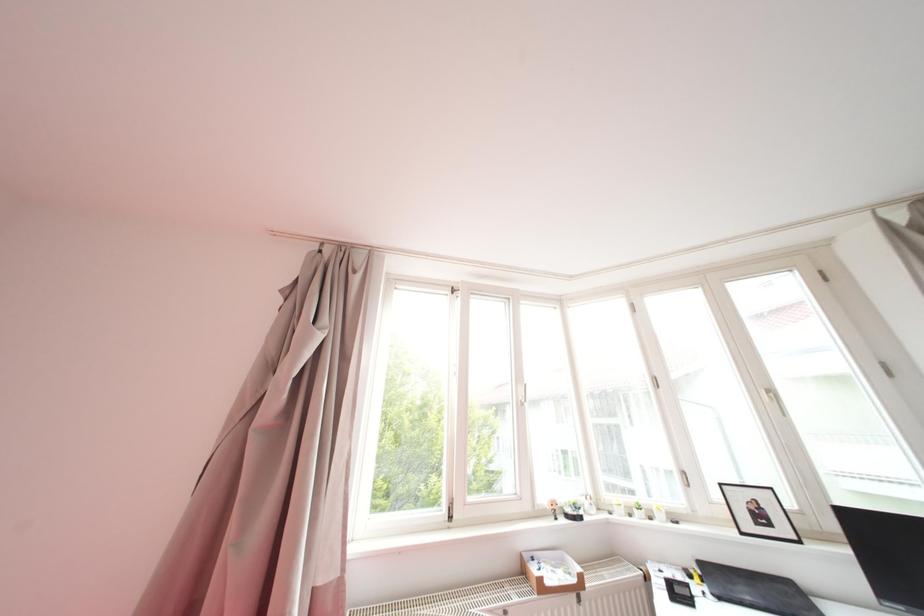
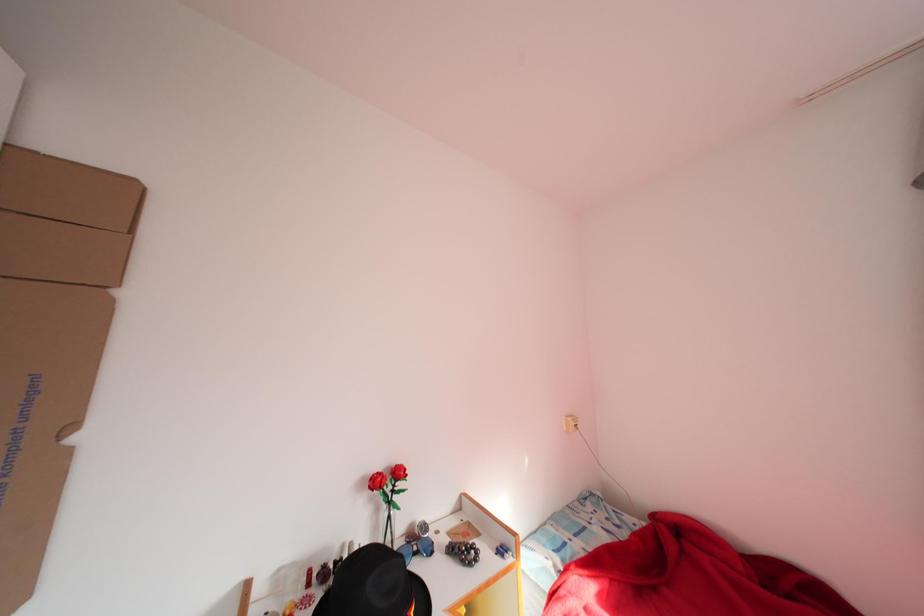
Question: The camera is either moving clockwise (left) or counter-clockwise (right) around the object. The first image is from the beginning of the video and the second image is from the end. Is the camera moving left or right when shooting the video?

Choices:
 (A) Left
 (B) Right

Answer: (B)